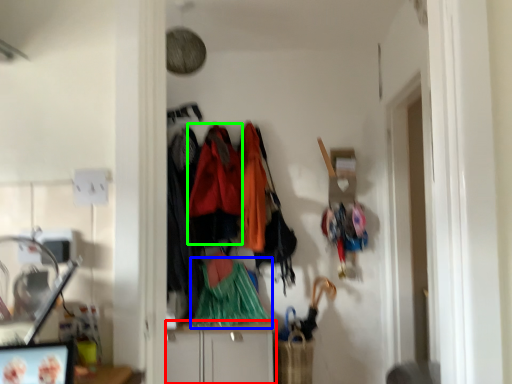
Question: Which object is the closest to the cabinetry (highlighted by a red box)? Choose among these: clothing (highlighted by a blue box) or clothing (highlighted by a green box).

Choices:
 (A) clothing
 (B) clothing

Answer: (A)